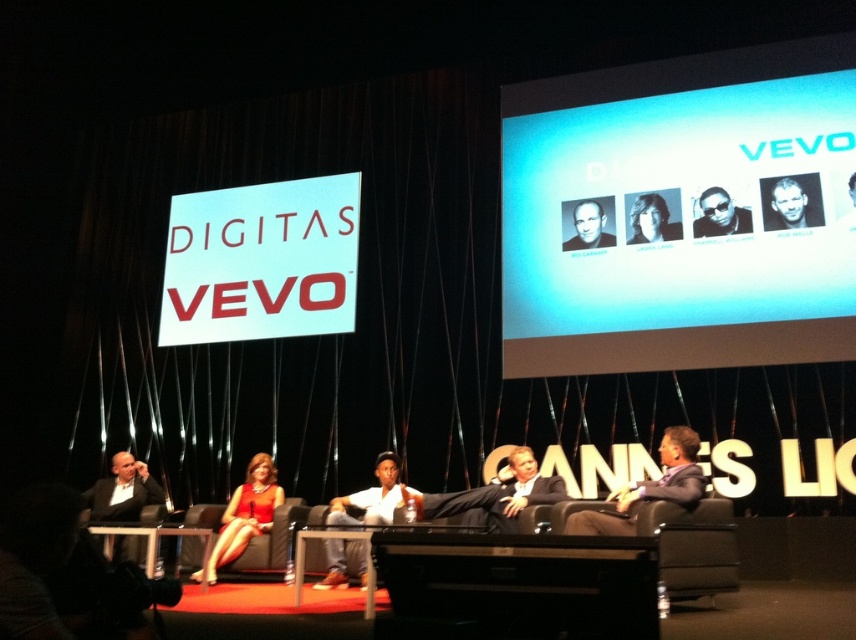
You are a photographer positioned at the back of the room. You want to take a photo of the dark gray suit at left and the smooth skin face at center. Which object will appear larger in your photo?

The dark gray suit at left appears larger in the photo because it is closer to the viewer than the smooth skin face at center.

Looking at the stage setup for the panel discussion, where is the shiny red dress at center in relation to the smooth skin face at upper right?

The shiny red dress at center is to the left of the smooth skin face at upper right.

You are a photographer at the event and want to capture both the shiny red dress at center and the smooth skin face at upper right in a single shot. Given that your camera has a fixed focal length, which object should you focus on to ensure both are in frame without moving the camera?

You should focus on the shiny red dress at center because it is larger in size than the smooth skin face at upper right, so keeping it centered will likely keep both in frame.